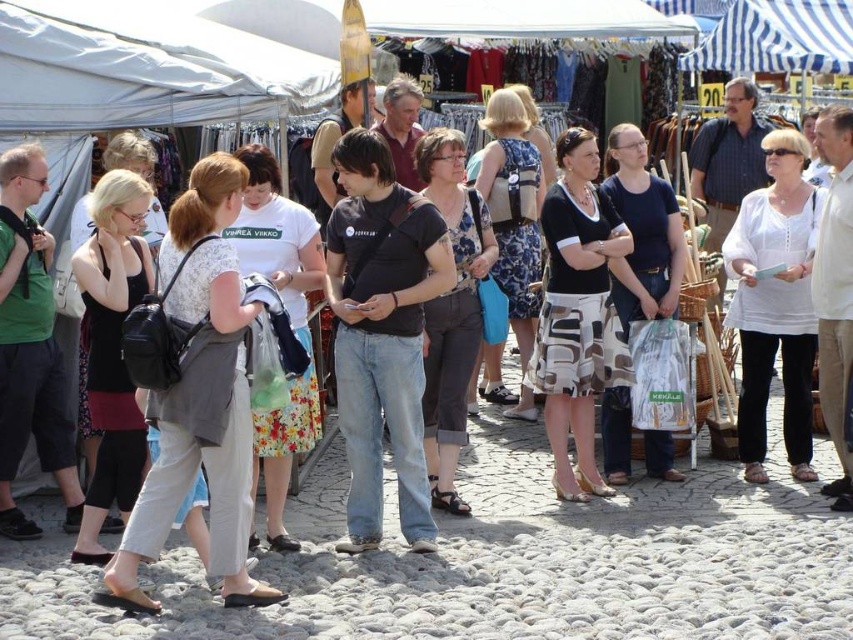
Does dark blue t-shirt at center lie in front of patterned fabric skirt at center?

Yes, dark blue t-shirt at center is closer to the viewer.

Who is positioned more to the right, dark blue t-shirt at center or patterned fabric skirt at center?

patterned fabric skirt at center

What do you see at coordinates (381, 332) in the screenshot? The height and width of the screenshot is (640, 853). I see `dark blue t-shirt at center` at bounding box center [381, 332].

In order to click on dark blue t-shirt at center in this screenshot , I will do `click(381, 332)`.

Is point (735, 304) closer to viewer compared to point (576, 490)?

No, it is behind (576, 490).

Locate an element on the screen. Image resolution: width=853 pixels, height=640 pixels. white cotton blouse at center is located at coordinates (775, 301).

Is point (788, 205) closer to camera compared to point (619, 244)?

No, it is behind (619, 244).

Locate an element on the screen. white cotton blouse at center is located at coordinates (775, 301).

The width and height of the screenshot is (853, 640). What do you see at coordinates (381, 332) in the screenshot? I see `dark blue t-shirt at center` at bounding box center [381, 332].

Does dark blue t-shirt at center have a greater height compared to white cotton blouse at center?

In fact, dark blue t-shirt at center may be shorter than white cotton blouse at center.

Does point (398, 296) come closer to viewer compared to point (741, 285)?

Yes, point (398, 296) is closer to viewer.

The width and height of the screenshot is (853, 640). In order to click on dark blue t-shirt at center in this screenshot , I will do `click(381, 332)`.